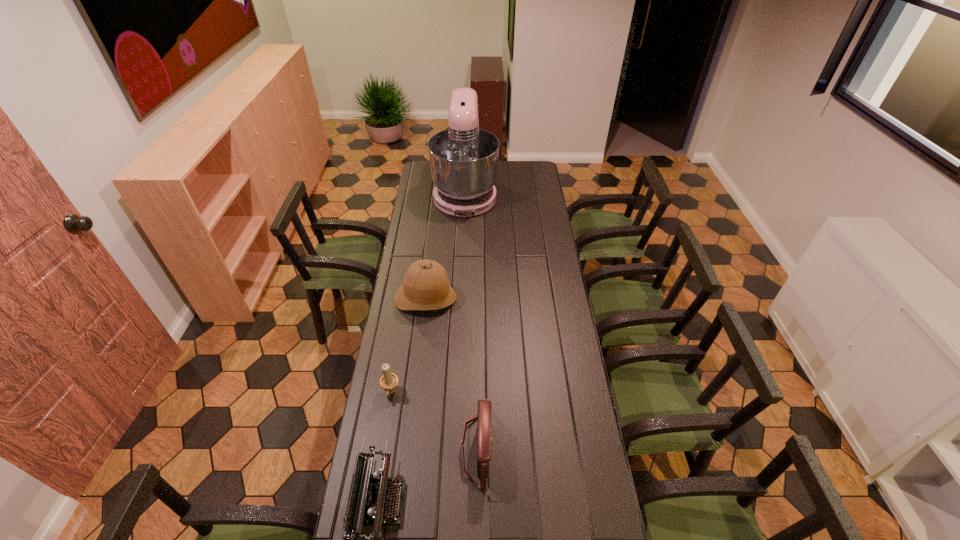
This screenshot has width=960, height=540. I want to click on object that is at the far edge, so click(x=463, y=159).

The image size is (960, 540). Find the location of `mixer that is at the left edge`. mixer that is at the left edge is located at coordinates (463, 159).

What are the coordinates of `hat that is at the left edge` in the screenshot? It's located at (426, 286).

This screenshot has width=960, height=540. I want to click on candle_holder that is positioned at the left edge, so click(x=388, y=381).

Where is `object positioned at the far left corner`? The width and height of the screenshot is (960, 540). object positioned at the far left corner is located at coordinates (463, 159).

In the image, there is a desktop. In order to click on vacant space at the left edge in this screenshot , I will do `click(429, 249)`.

You are a GUI agent. You are given a task and a screenshot of the screen. Output one action in this format:
    pyautogui.click(x=<x>, y=<y>)
    Task: Click on the free region at the right edge of the desktop
    
    Given the screenshot: What is the action you would take?
    pyautogui.click(x=570, y=484)

This screenshot has height=540, width=960. I want to click on free space between the shoulder bag and the hat, so click(x=451, y=374).

Find the location of `vacant space in between the hat and the candle_holder`. vacant space in between the hat and the candle_holder is located at coordinates (408, 346).

This screenshot has width=960, height=540. Find the location of `free space between the third farthest object and the shoulder bag`. free space between the third farthest object and the shoulder bag is located at coordinates (434, 421).